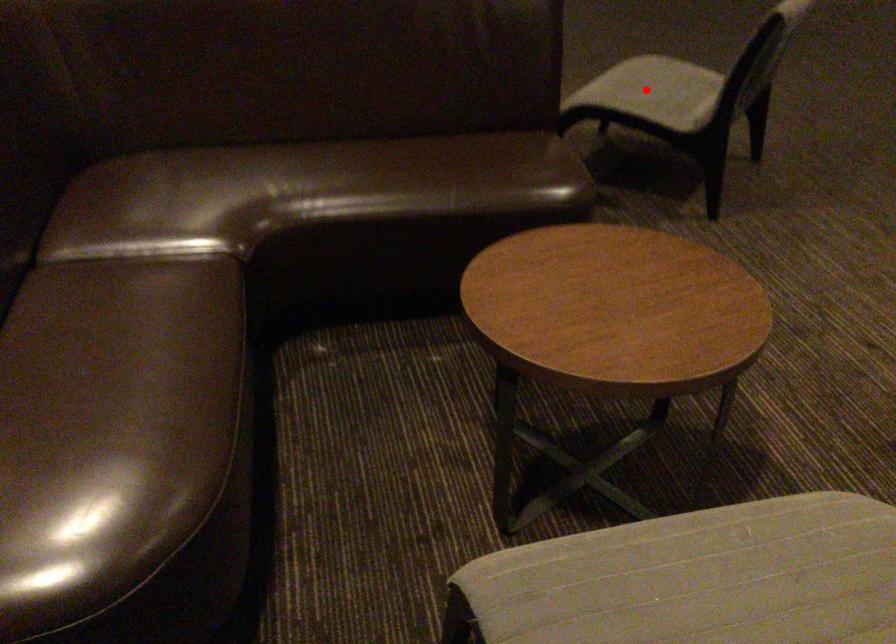
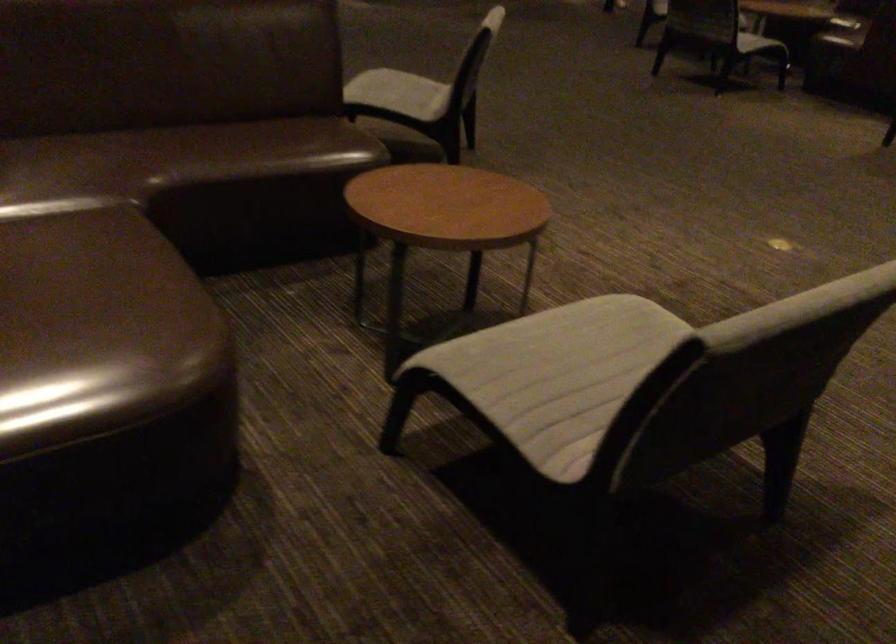
Question: I am providing you with two images of the same scene from different viewpoints. Image1 has a red point marked. In image2, the corresponding 3D location appears at what relative position? Reply with the corresponding letter.

Choices:
 (A) Closer
 (B) Farther

Answer: (B)